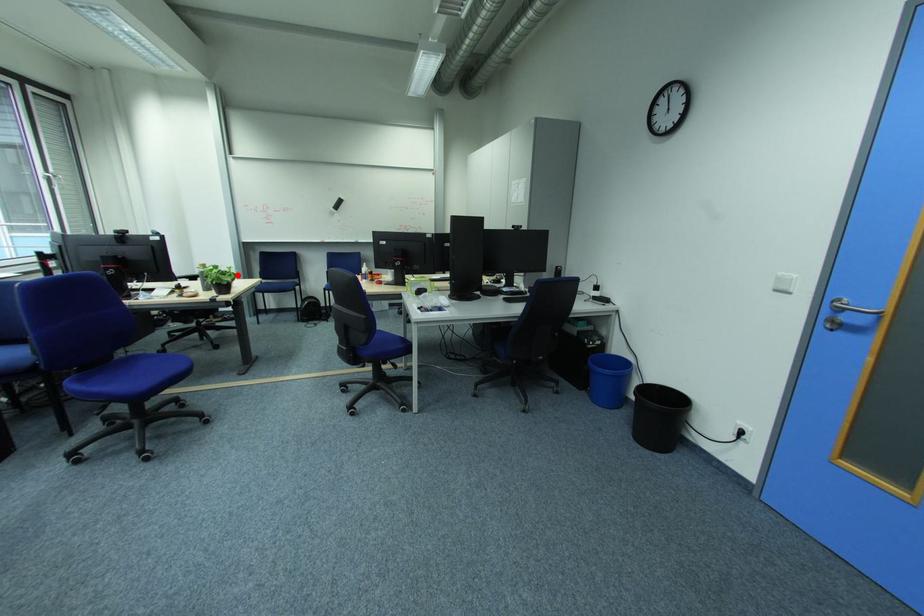
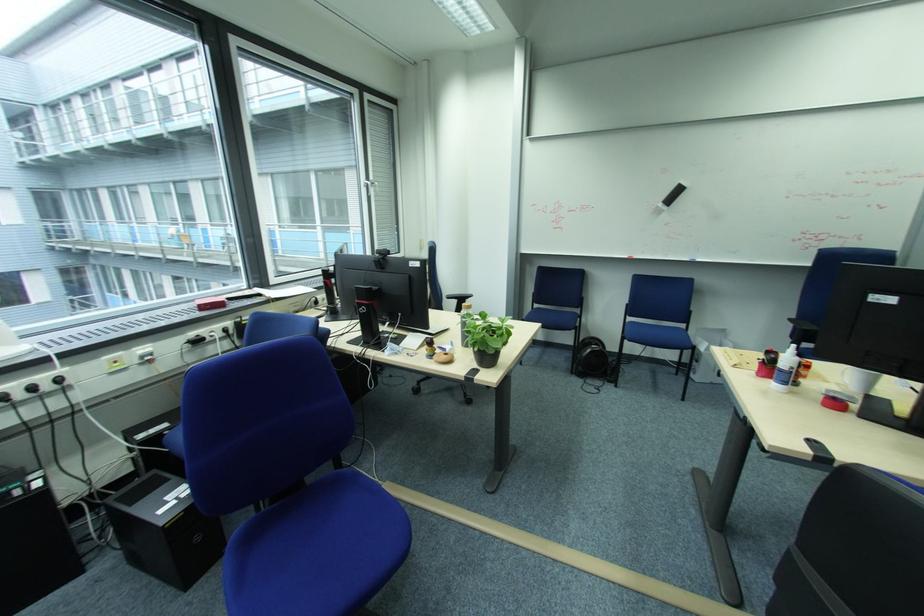
Find the pixel in the second image that matches the highlighted location in the first image.

(508, 333)